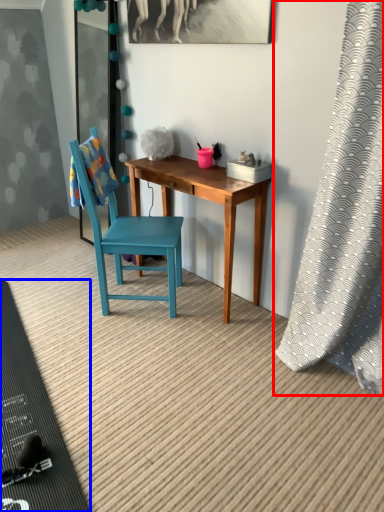
Question: Among these objects, which one is nearest to the camera, curtain (highlighted by a red box) or mat (highlighted by a blue box)?

Choices:
 (A) curtain
 (B) mat

Answer: (A)